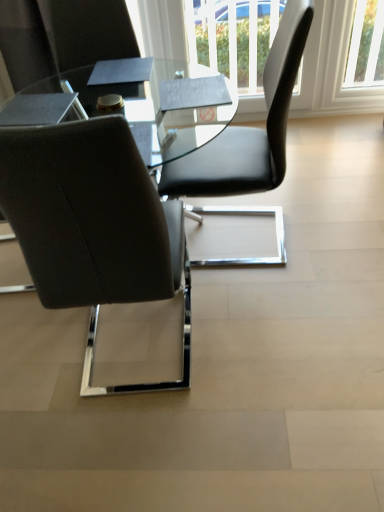
Question: From a real-world perspective, is matte black chair at left, the 1th chair when ordered from left to right, physically above black leather chair at upper right, acting as the first chair starting from the right?

Choices:
 (A) no
 (B) yes

Answer: (B)

Question: Considering the relative positions of matte black chair at left, the 2th chair from the right, and black leather chair at upper right, acting as the 2th chair starting from the left, in the image provided, is matte black chair at left, the 2th chair from the right, to the left of black leather chair at upper right, acting as the 2th chair starting from the left, from the viewer's perspective?

Choices:
 (A) no
 (B) yes

Answer: (B)

Question: Can we say matte black chair at left, the 1th chair when ordered from left to right, lies outside black leather chair at upper right, acting as the 2th chair starting from the left?

Choices:
 (A) yes
 (B) no

Answer: (A)

Question: Is matte black chair at left, the 1th chair when ordered from left to right, thinner than black leather chair at upper right, acting as the 2th chair starting from the left?

Choices:
 (A) no
 (B) yes

Answer: (B)

Question: Considering the relative sizes of matte black chair at left, the 2th chair from the right, and black leather chair at upper right, acting as the first chair starting from the right, in the image provided, is matte black chair at left, the 2th chair from the right, wider than black leather chair at upper right, acting as the first chair starting from the right,?

Choices:
 (A) yes
 (B) no

Answer: (B)

Question: Is white plastic window at upper right wider or thinner than matte black chair at left, the 1th chair when ordered from left to right?

Choices:
 (A) thin
 (B) wide

Answer: (A)

Question: Would you say white plastic window at upper right is inside or outside matte black chair at left, the 2th chair from the right?

Choices:
 (A) outside
 (B) inside

Answer: (A)

Question: From a real-world perspective, is white plastic window at upper right above or below matte black chair at left, the 2th chair from the right?

Choices:
 (A) above
 (B) below

Answer: (B)

Question: Based on their sizes in the image, would you say white plastic window at upper right is bigger or smaller than matte black chair at left, the 1th chair when ordered from left to right?

Choices:
 (A) small
 (B) big

Answer: (A)

Question: Is white plastic window at upper right bigger or smaller than black leather chair at upper right, acting as the 2th chair starting from the left?

Choices:
 (A) small
 (B) big

Answer: (A)

Question: Is white plastic window at upper right situated inside black leather chair at upper right, acting as the first chair starting from the right, or outside?

Choices:
 (A) outside
 (B) inside

Answer: (A)

Question: Considering the positions of point (357, 73) and point (205, 159), is point (357, 73) closer or farther from the camera than point (205, 159)?

Choices:
 (A) farther
 (B) closer

Answer: (A)

Question: From the image's perspective, is white plastic window at upper right positioned above or below black leather chair at upper right, acting as the first chair starting from the right?

Choices:
 (A) above
 (B) below

Answer: (A)

Question: Looking at the image, does transparent glass table at center seem bigger or smaller compared to black leather chair at upper right, acting as the first chair starting from the right?

Choices:
 (A) big
 (B) small

Answer: (A)

Question: Relative to black leather chair at upper right, acting as the first chair starting from the right, is transparent glass table at center in front or behind?

Choices:
 (A) front
 (B) behind

Answer: (B)